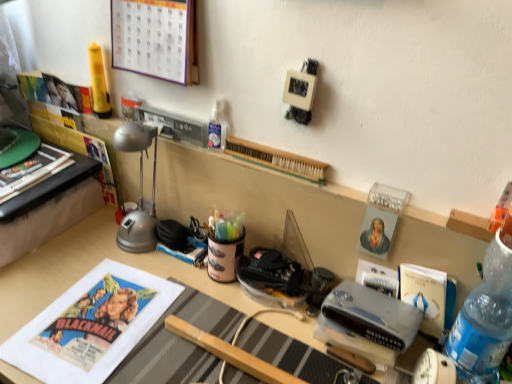
At what (x,y) coordinates should I click in order to perform the action: click on empty space that is ontop of white paper poster at center. Please return your answer as a coordinate pair (x, y). This screenshot has width=512, height=384. Looking at the image, I should click on point(88,316).